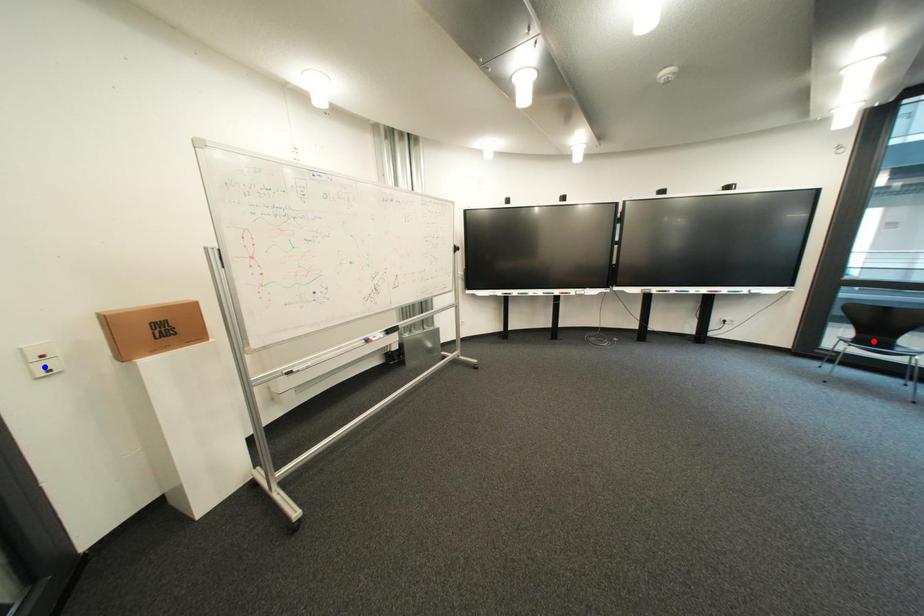
Question: Which of the two points in the image is closer to the camera?

Choices:
 (A) Blue point is closer.
 (B) Red point is closer.

Answer: (A)